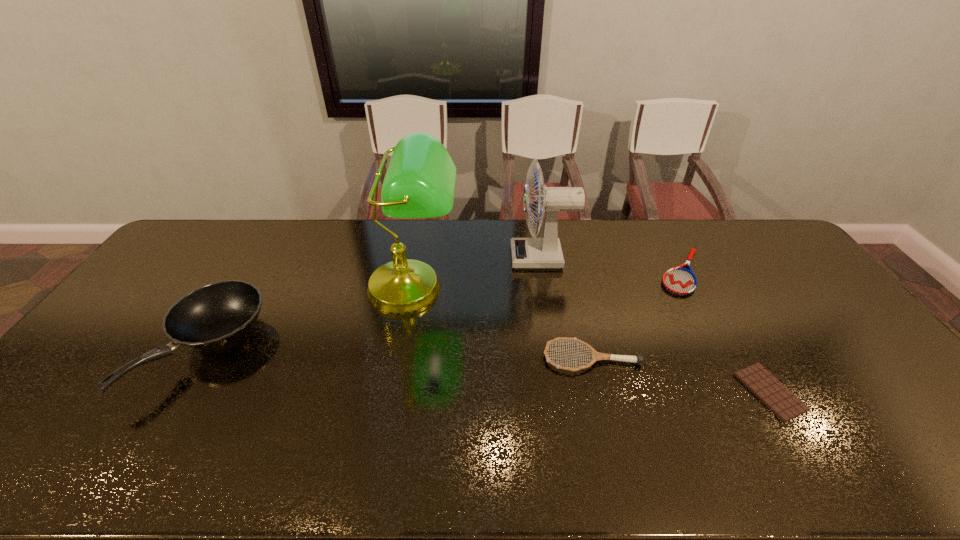
The width and height of the screenshot is (960, 540). I want to click on lamp, so click(420, 180).

Image resolution: width=960 pixels, height=540 pixels. Find the location of `the fifth object from right to left`. the fifth object from right to left is located at coordinates (420, 180).

Where is `the fifth shortest object`? the fifth shortest object is located at coordinates (527, 253).

Where is `the fourth shortest object`? the fourth shortest object is located at coordinates (215, 315).

Identify the location of the leftmost object. (215, 315).

What are the coordinates of `the taller tennis racket` in the screenshot? It's located at (596, 356).

Identify the location of the nearer tennis racket. (596, 356).

Identify the location of the second shortest object. (678, 280).

This screenshot has width=960, height=540. I want to click on the farther tennis racket, so click(x=678, y=280).

The height and width of the screenshot is (540, 960). I want to click on chocolate bar, so click(x=780, y=400).